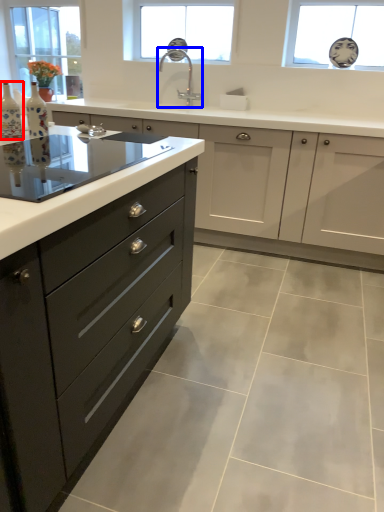
Question: Which of the following is the closest to the observer, bottle (highlighted by a red box) or sink (highlighted by a blue box)?

Choices:
 (A) bottle
 (B) sink

Answer: (A)